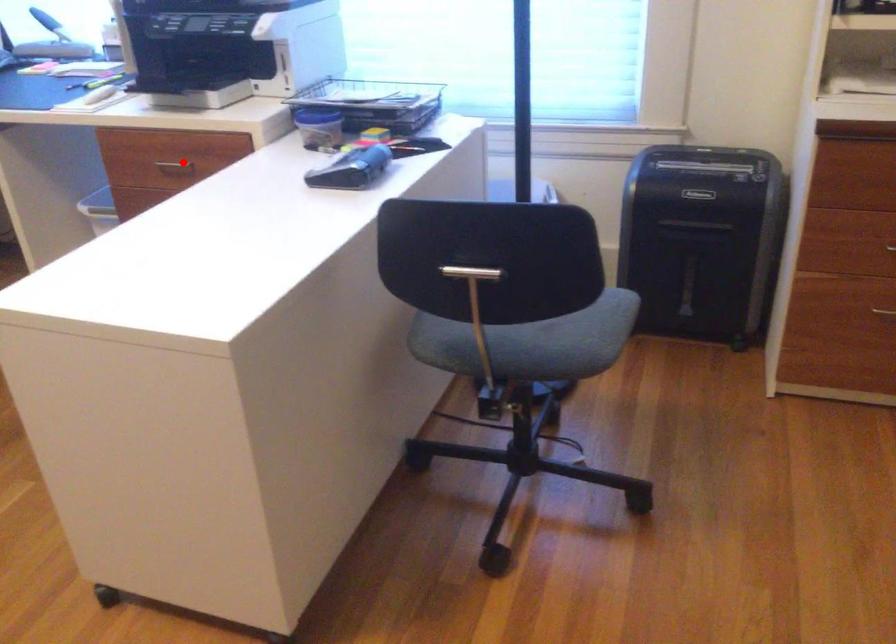
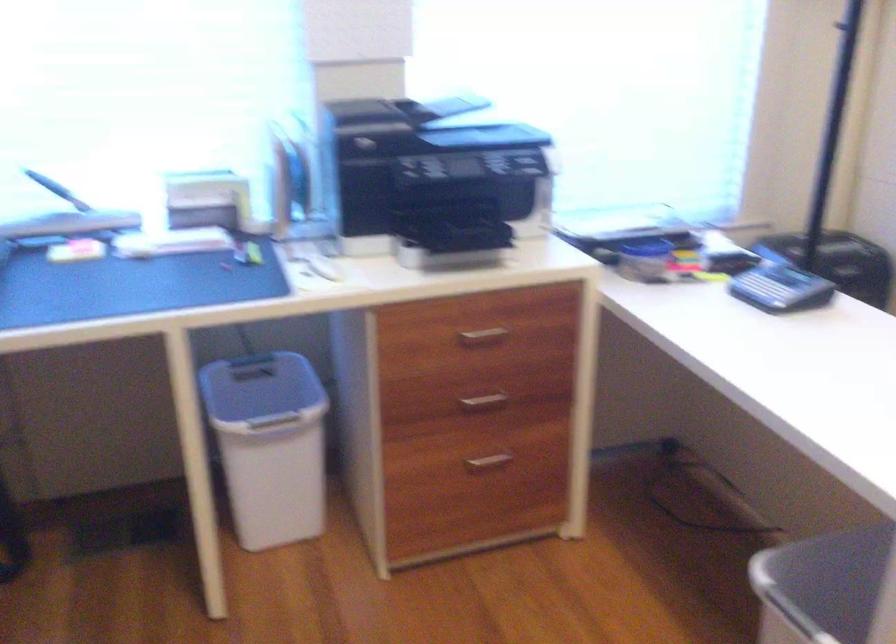
Question: I am providing you with two images of the same scene from different viewpoints. A red point is marked on the first image. Can you still see the location of the red point in image 2?

Choices:
 (A) Yes
 (B) No

Answer: (A)